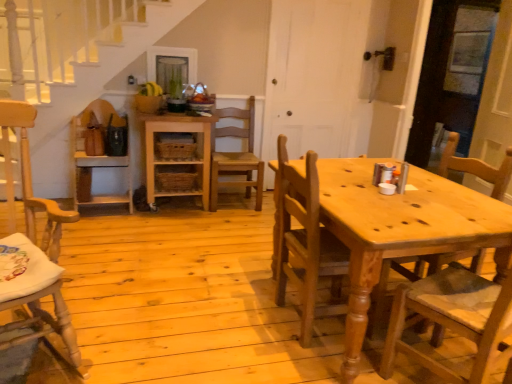
Image resolution: width=512 pixels, height=384 pixels. Identify the location of vacant region in front of natural wood chair at center, which appears as the second chair when viewed from the right. (296, 362).